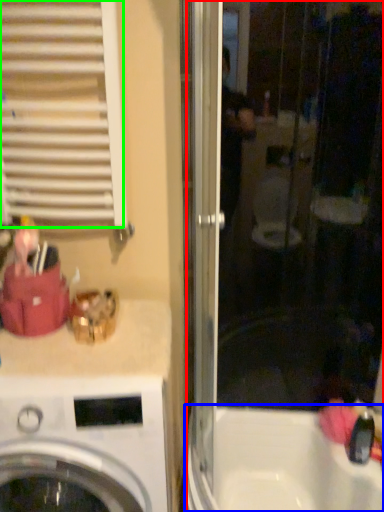
Question: Which object is positioned farthest from screen door (highlighted by a red box)? Select from bath (highlighted by a blue box) and shutter (highlighted by a green box).

Choices:
 (A) bath
 (B) shutter

Answer: (B)